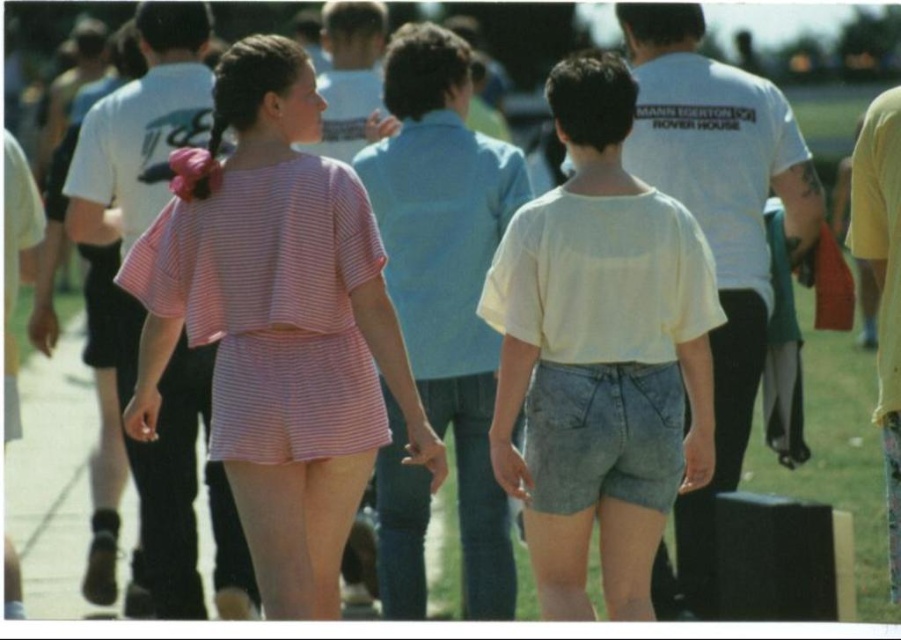
Question: Which of the following is the closest to the observer?

Choices:
 (A) (312, 214)
 (B) (394, 193)
 (C) (598, 208)

Answer: (A)

Question: Which object is positioned closest to the pink striped fabric shorts at center?

Choices:
 (A) pink striped shirt at center
 (B) light yellow cotton shirt at center

Answer: (B)

Question: Which point is farther to the camera?

Choices:
 (A) light yellow cotton shirt at center
 (B) pink striped shirt at center
 (C) pink striped fabric shorts at center

Answer: (B)

Question: Is light yellow cotton shirt at center positioned before pink striped shirt at center?

Choices:
 (A) no
 (B) yes

Answer: (B)

Question: Is light yellow cotton shirt at center thinner than pink striped shirt at center?

Choices:
 (A) no
 (B) yes

Answer: (A)

Question: Is light yellow cotton shirt at center to the left of pink striped shirt at center from the viewer's perspective?

Choices:
 (A) no
 (B) yes

Answer: (A)